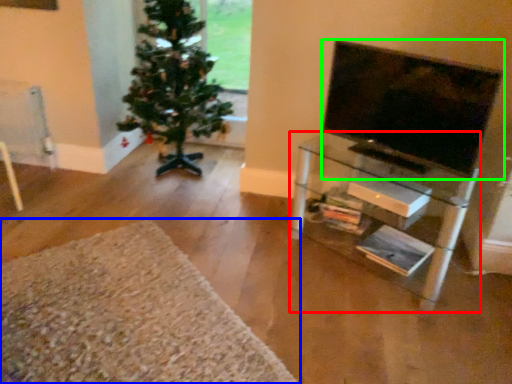
Question: Estimate the real-world distances between objects in this image. Which object is closer to shelf (highlighted by a red box), plain (highlighted by a blue box) or television (highlighted by a green box)?

Choices:
 (A) plain
 (B) television

Answer: (B)